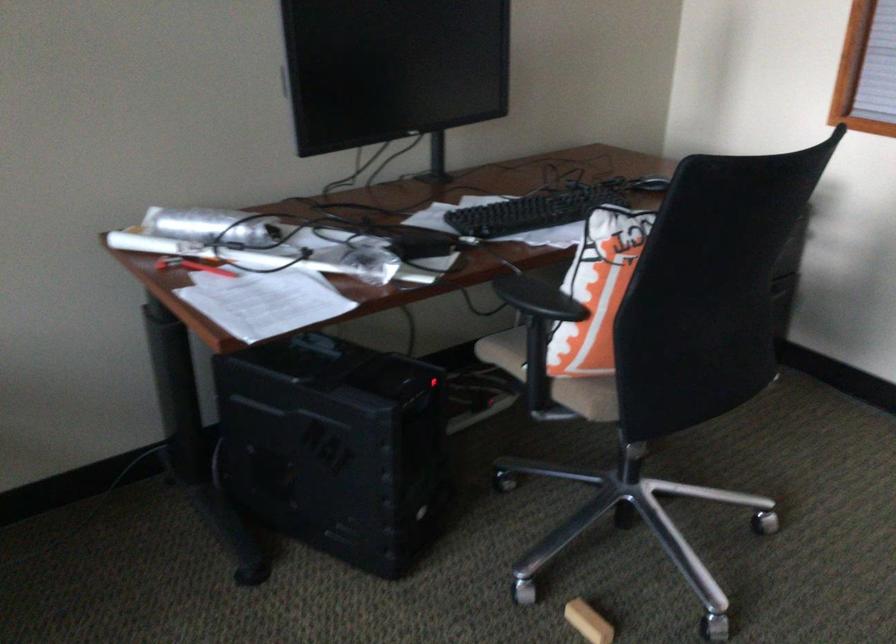
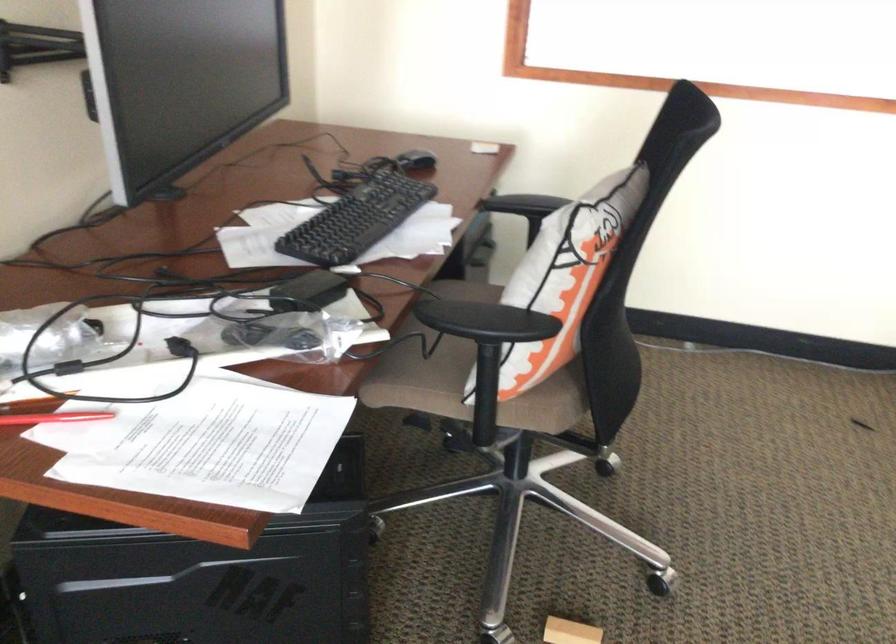
Where in the second image is the point corresponding to (581,392) from the first image?

(543, 408)